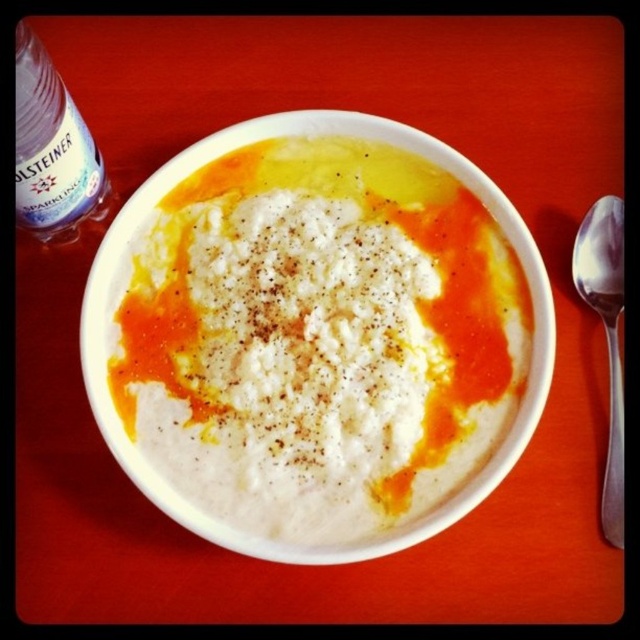
Question: Estimate the real-world distances between objects in this image. Which object is farther from the satin silver spoon at right?

Choices:
 (A) white creamy soup at center
 (B) transparent plastic bottle at upper left

Answer: (B)

Question: Which point is closer to the camera taking this photo?

Choices:
 (A) (609, 230)
 (B) (26, 38)

Answer: (B)

Question: Does white creamy soup at center lie in front of transparent plastic bottle at upper left?

Choices:
 (A) yes
 (B) no

Answer: (B)

Question: From the image, what is the correct spatial relationship of white creamy soup at center in relation to transparent plastic bottle at upper left?

Choices:
 (A) below
 (B) above

Answer: (A)

Question: Is white creamy soup at center to the left of transparent plastic bottle at upper left from the viewer's perspective?

Choices:
 (A) no
 (B) yes

Answer: (A)

Question: Which is nearer to the satin silver spoon at right?

Choices:
 (A) transparent plastic bottle at upper left
 (B) white creamy soup at center

Answer: (B)